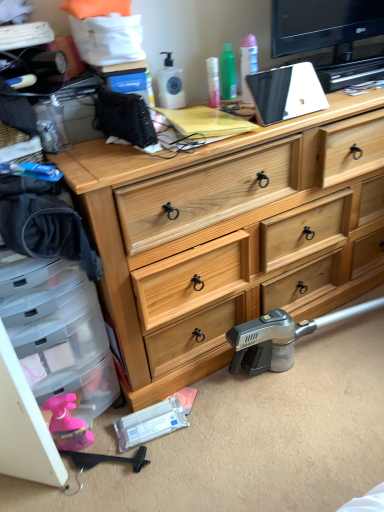
Question: Would you say natural wood chest of drawers at center is inside or outside black plastic hammer at lower left?

Choices:
 (A) outside
 (B) inside

Answer: (A)

Question: From the image's perspective, is natural wood chest of drawers at center above or below black plastic hammer at lower left?

Choices:
 (A) above
 (B) below

Answer: (A)

Question: Is natural wood chest of drawers at center wider or thinner than black plastic hammer at lower left?

Choices:
 (A) thin
 (B) wide

Answer: (B)

Question: From their relative heights in the image, would you say black plastic hammer at lower left is taller or shorter than natural wood chest of drawers at center?

Choices:
 (A) tall
 (B) short

Answer: (B)

Question: From the image's perspective, is black plastic hammer at lower left above or below natural wood chest of drawers at center?

Choices:
 (A) below
 (B) above

Answer: (A)

Question: Does point (127, 459) appear closer or farther from the camera than point (243, 315)?

Choices:
 (A) closer
 (B) farther

Answer: (A)

Question: Is black plastic hammer at lower left wider or thinner than natural wood chest of drawers at center?

Choices:
 (A) wide
 (B) thin

Answer: (B)